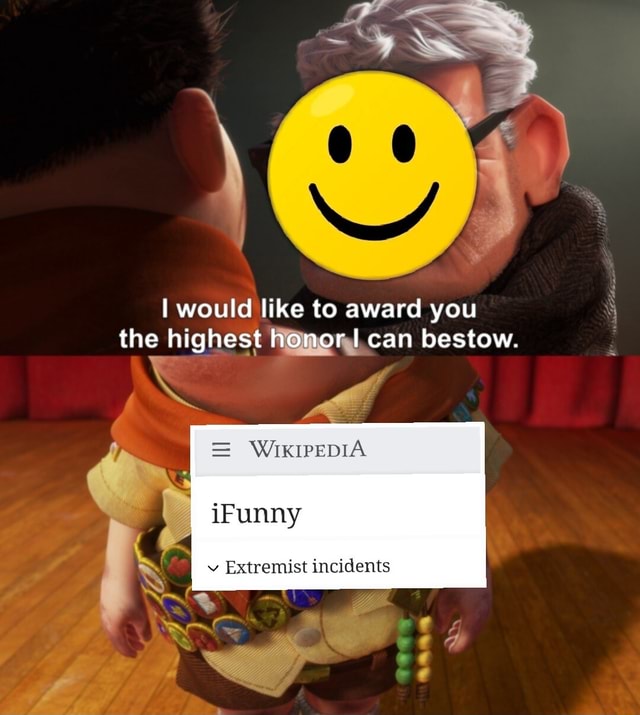
I want to click on red curtain, so click(562, 385).